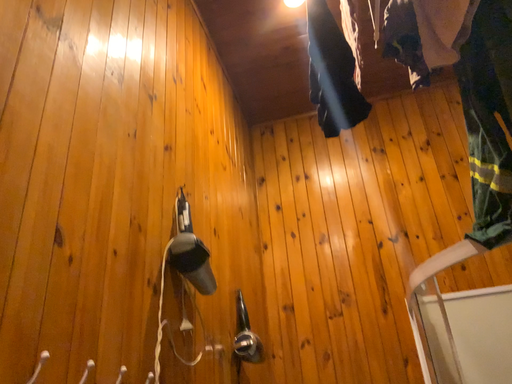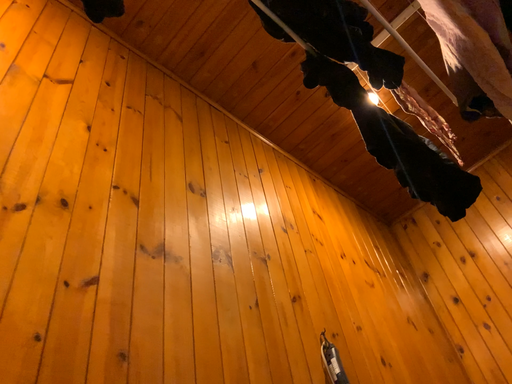
Question: Which way did the camera rotate in the video?

Choices:
 (A) rotated upward
 (B) rotated downward

Answer: (A)